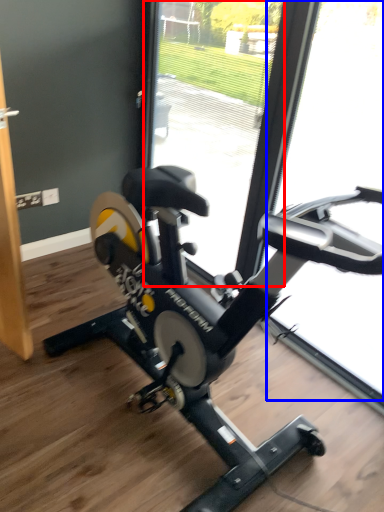
Question: Which object appears farthest to the camera in this image, glass door (highlighted by a red box) or glass door (highlighted by a blue box)?

Choices:
 (A) glass door
 (B) glass door

Answer: (A)